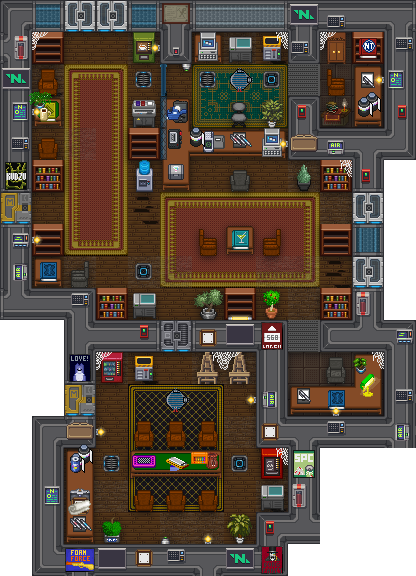
Locate an element on the screen. This screenshot has height=576, width=416. cobwebs is located at coordinates (283, 448), (379, 359), (226, 351), (100, 354), (35, 37), (282, 37), (323, 36), (348, 161).